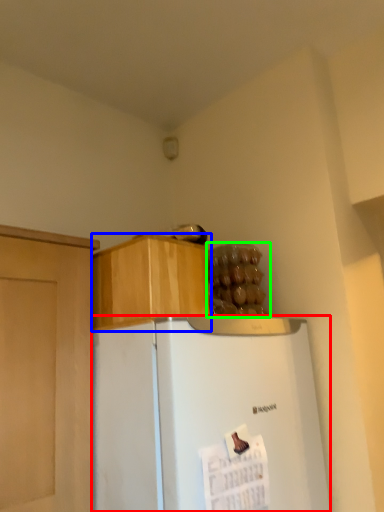
Question: Which object is the closest to the refrigerator (highlighted by a red box)? Choose among these: cabinetry (highlighted by a blue box) or food (highlighted by a green box).

Choices:
 (A) cabinetry
 (B) food

Answer: (A)